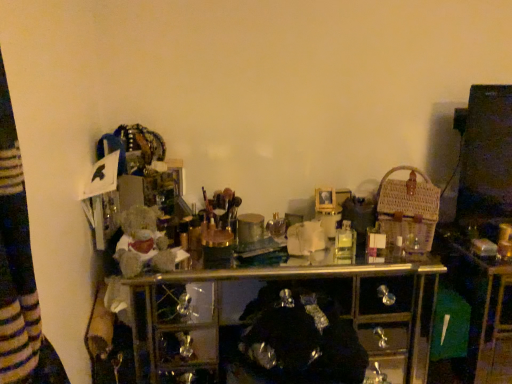
Question: Is clear plastic bottle at center smaller than woven brown basket at right?

Choices:
 (A) yes
 (B) no

Answer: (B)

Question: Is clear plastic bottle at center not within woven brown basket at right?

Choices:
 (A) no
 (B) yes

Answer: (B)

Question: Considering the relative sizes of clear plastic bottle at center and woven brown basket at right in the image provided, is clear plastic bottle at center taller than woven brown basket at right?

Choices:
 (A) yes
 (B) no

Answer: (A)

Question: From the image's perspective, is clear plastic bottle at center below woven brown basket at right?

Choices:
 (A) no
 (B) yes

Answer: (B)

Question: Does clear plastic bottle at center have a lesser height compared to woven brown basket at right?

Choices:
 (A) yes
 (B) no

Answer: (B)

Question: Does clear plastic bottle at center appear on the right side of woven brown basket at right?

Choices:
 (A) yes
 (B) no

Answer: (A)

Question: Is woven brown basket at right turned away from clear plastic bottle at center?

Choices:
 (A) yes
 (B) no

Answer: (B)

Question: From the image's perspective, is woven brown basket at right beneath clear plastic bottle at center?

Choices:
 (A) no
 (B) yes

Answer: (A)

Question: Considering the relative sizes of woven brown basket at right and clear plastic bottle at center in the image provided, is woven brown basket at right thinner than clear plastic bottle at center?

Choices:
 (A) yes
 (B) no

Answer: (A)

Question: Considering the relative sizes of woven brown basket at right and clear plastic bottle at center in the image provided, is woven brown basket at right bigger than clear plastic bottle at center?

Choices:
 (A) yes
 (B) no

Answer: (B)

Question: Is woven brown basket at right in front of clear plastic bottle at center?

Choices:
 (A) yes
 (B) no

Answer: (B)

Question: Can you confirm if woven brown basket at right is taller than clear plastic bottle at center?

Choices:
 (A) no
 (B) yes

Answer: (A)

Question: Is woven brown basket at right in front of or behind clear plastic bottle at center in the image?

Choices:
 (A) front
 (B) behind

Answer: (B)